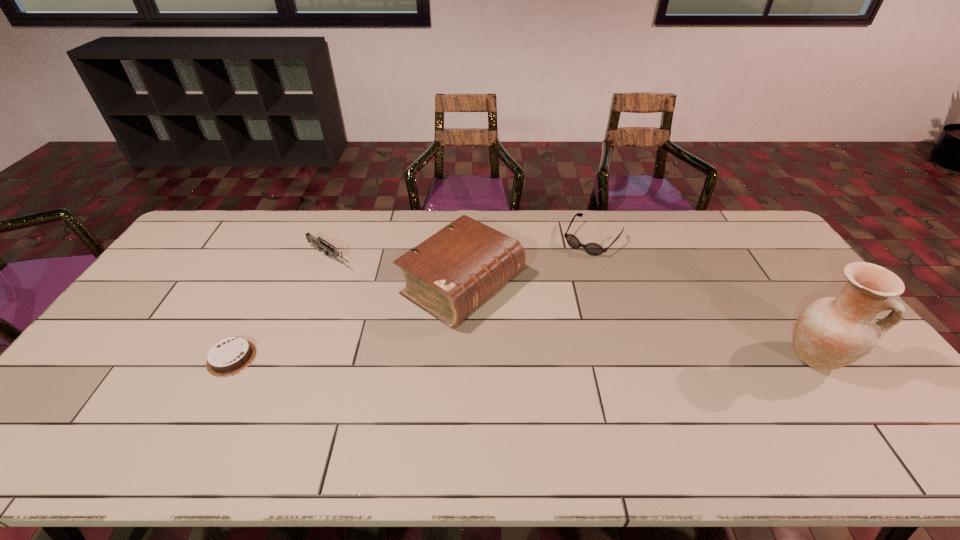
The height and width of the screenshot is (540, 960). In order to click on free space at the far right corner of the desktop in this screenshot , I will do `click(766, 234)`.

At what (x,y) coordinates should I click in order to perform the action: click on vacant space that's between the gun and the third object from right to left. Please return your answer as a coordinate pair (x, y). This screenshot has width=960, height=540. Looking at the image, I should click on (396, 271).

This screenshot has width=960, height=540. What are the coordinates of `free area in between the third object from left to right and the third shortest object` in the screenshot? It's located at [396, 271].

Find the location of a particular element. This screenshot has height=540, width=960. vacant space that's between the tallest object and the second shortest object is located at coordinates (703, 299).

I want to click on free space between the sunglasses and the rightmost object, so click(703, 299).

Where is `vacant area between the tallest object and the Bible`? This screenshot has height=540, width=960. vacant area between the tallest object and the Bible is located at coordinates (637, 321).

Where is `empty location between the leftmost object and the third object from left to right`? empty location between the leftmost object and the third object from left to right is located at coordinates (347, 321).

Where is `free space between the fourth object from right to left and the Bible`? free space between the fourth object from right to left and the Bible is located at coordinates (396, 271).

The width and height of the screenshot is (960, 540). I want to click on vacant area that lies between the Bible and the chocolate cake, so click(347, 321).

At what (x,y) coordinates should I click in order to perform the action: click on the closest object relative to the tallest object. Please return your answer as a coordinate pair (x, y). Looking at the image, I should click on (594, 249).